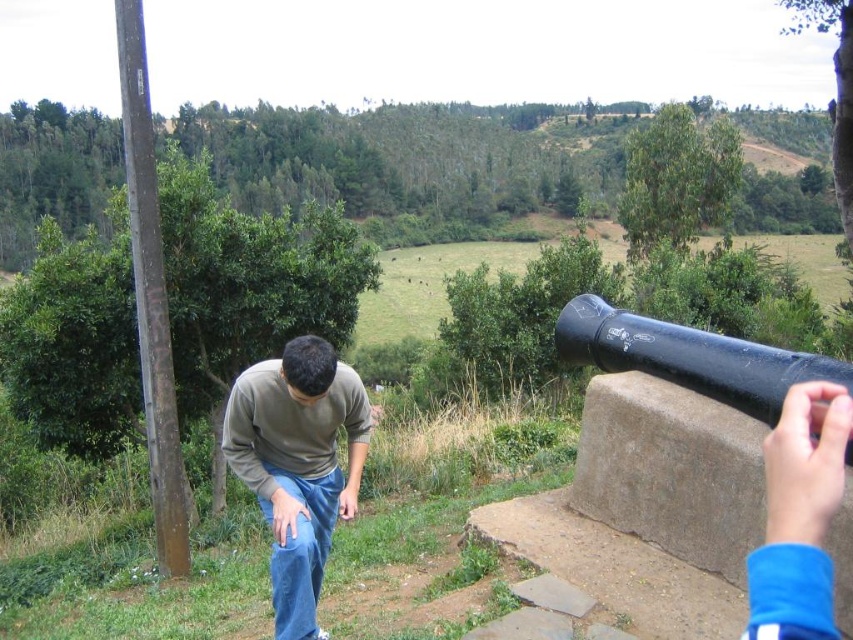
You are a visitor at a historical site and see the blue fabric hand at lower right and the black matte cannon at right. Which object takes up more visual space in the image?

The black matte cannon at right takes up more visual space than the blue fabric hand at lower right because the blue fabric hand at lower right occupies less space than the black matte cannon at right.

You are an engineer inspecting a site and need to determine if the blue fabric hand at lower right can fit through a narrow opening that accommodates objects up to the width of the black matte cannon at right. Based on the scene, what is your assessment?

The blue fabric hand at lower right has a lesser width compared to the black matte cannon at right, so it can fit through the opening designed for the cannon.

You are standing at the point labeled as point (780, 396) in the image. Looking towards the direction where the hand is pointing, can you see the point labeled as point (242, 378)?

Point (242, 378) is behind point (780, 396), so if you are standing at point (780, 396) and looking in the direction the hand is pointing, you might not see point (242, 378) because it is obscured by the object in front.